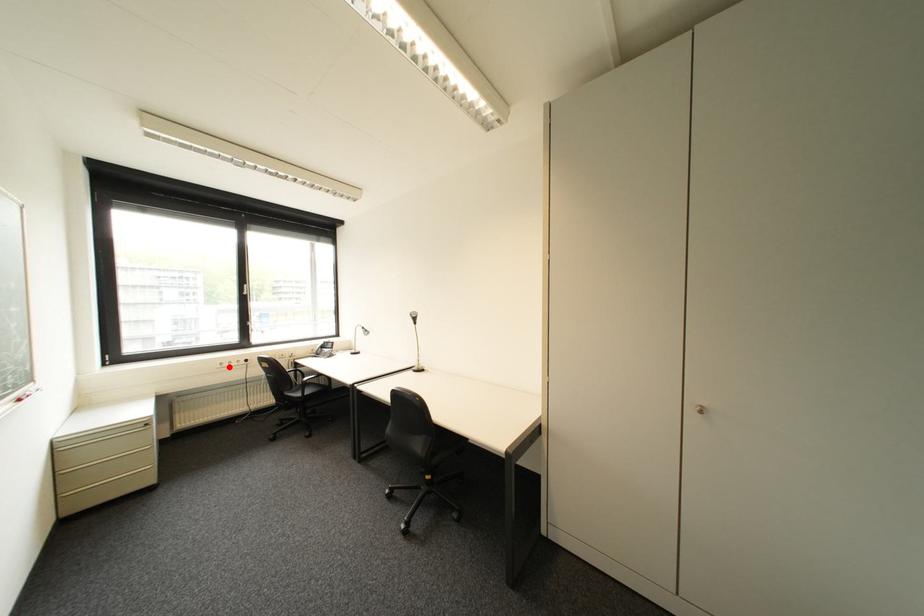
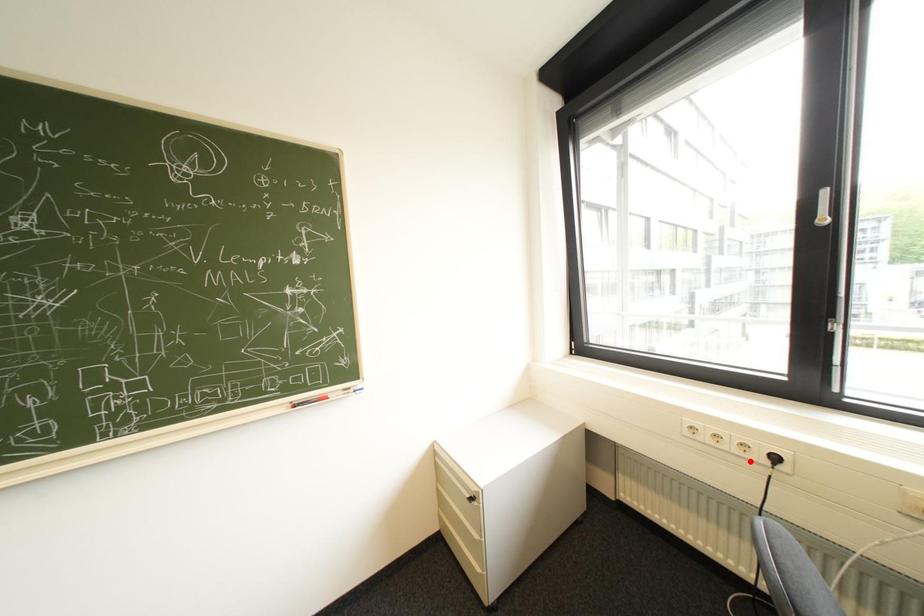
I am providing you with two images of the same scene from different viewpoints. A red point is marked on the first image and another point is marked on the second image. Are the points marked in image1 and image2 representing the same 3D position?

No